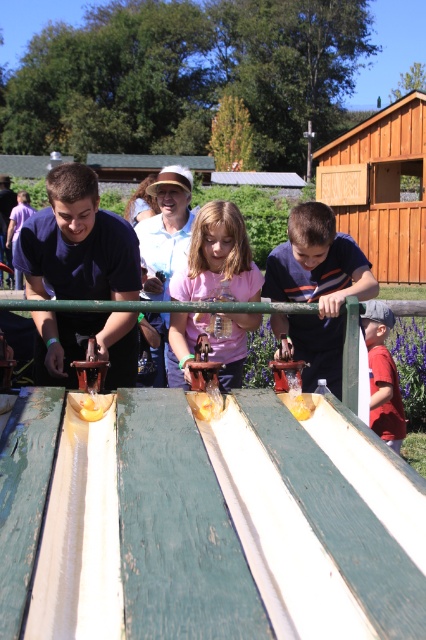
You are a photographer taking a picture of the pink matte shirt at center and the yellow rubber duck at center. Which object will appear bigger in your photo?

The pink matte shirt at center is larger in size than the yellow rubber duck at center, so it will appear bigger in the photo.

You are a child trying to reach the yellow rubber boat at center from the green weathered wood ramp at center. Which direction should you move to get to the boat?

The green weathered wood ramp at center is to the left of the yellow rubber boat at center, so you should move to the right to reach the boat.